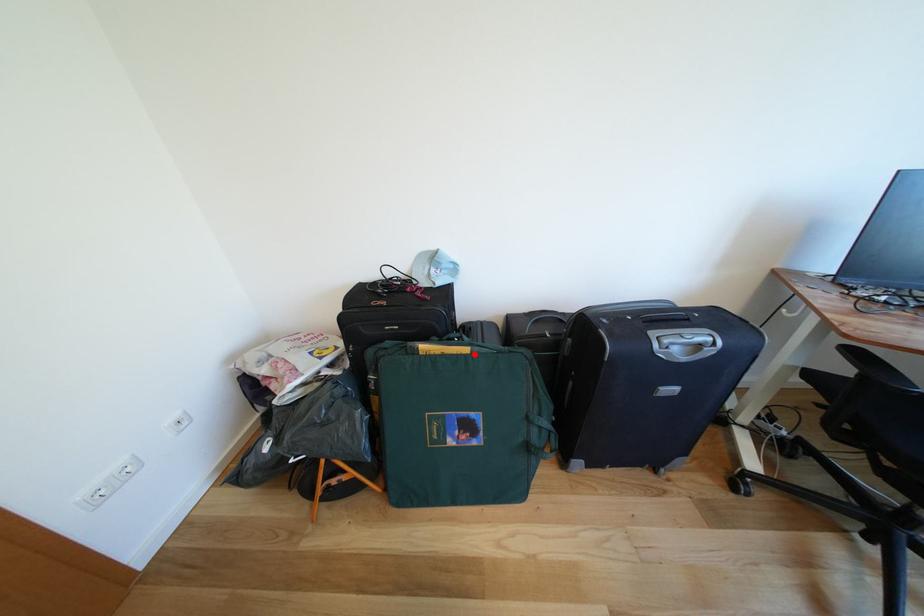
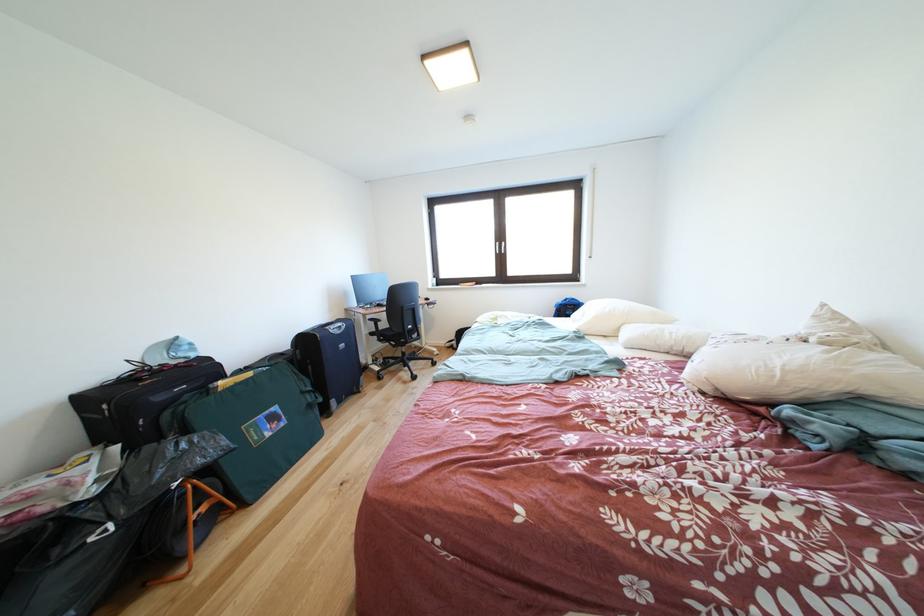
Find the pixel in the second image that matches the highlighted location in the first image.

(259, 379)